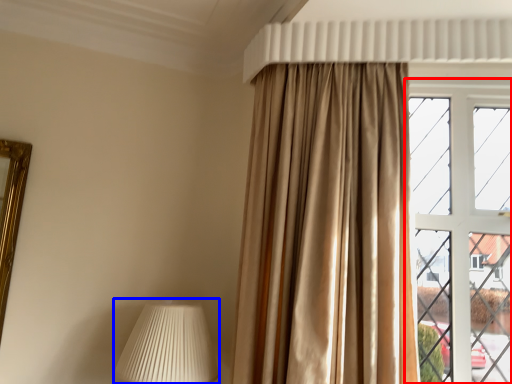
Question: Which point is further to the camera, window (highlighted by a red box) or table lamp (highlighted by a blue box)?

Choices:
 (A) window
 (B) table lamp

Answer: (A)